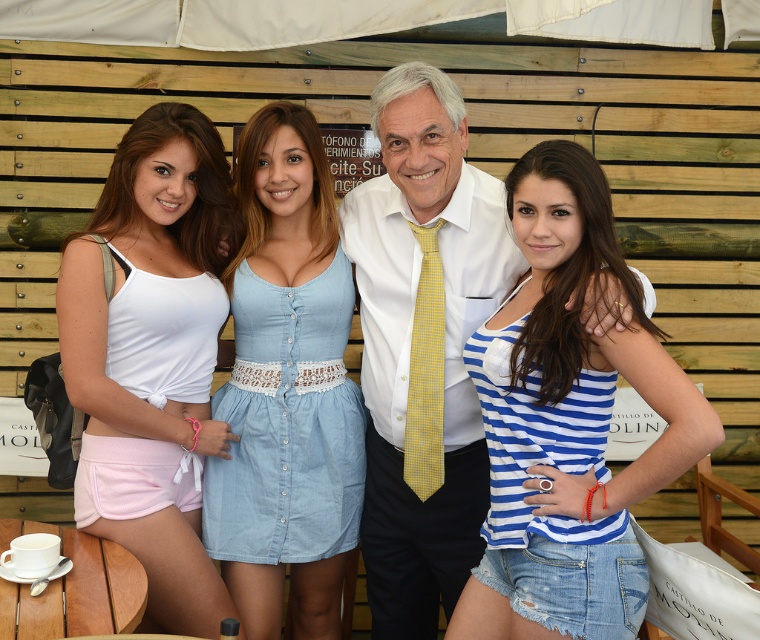
Who is shorter, blue striped tank top at center or denim dress at center?

blue striped tank top at center is shorter.

Who is more forward, (513, 220) or (271, 332)?

Positioned in front is point (513, 220).

Locate an element on the screen. This screenshot has height=640, width=760. blue striped tank top at center is located at coordinates (567, 420).

Does white smooth shirt at center have a greater width compared to matte white tank top at left?

Correct, the width of white smooth shirt at center exceeds that of matte white tank top at left.

Is point (412, 218) less distant than point (214, 355)?

Yes, it is.

This screenshot has height=640, width=760. Describe the element at coordinates (423, 346) in the screenshot. I see `white smooth shirt at center` at that location.

This screenshot has height=640, width=760. I want to click on white smooth shirt at center, so click(x=423, y=346).

Does blue striped tank top at center come behind yellow dotted tie at center?

No, blue striped tank top at center is in front of yellow dotted tie at center.

Who is more forward, (594, 605) or (407, 461)?

Positioned in front is point (594, 605).

The height and width of the screenshot is (640, 760). I want to click on blue striped tank top at center, so click(x=567, y=420).